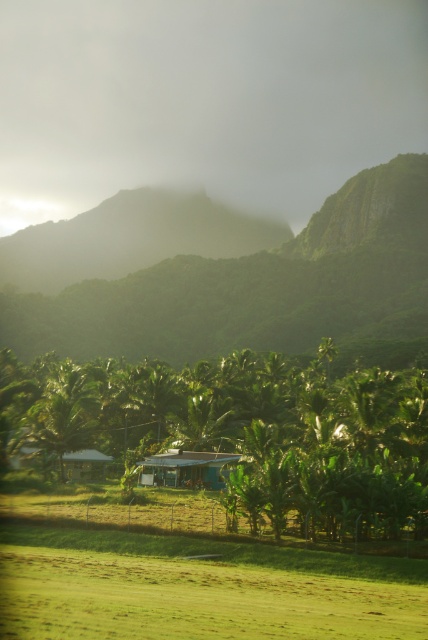
Can you confirm if green leafy tree at lower center is smaller than green corrugated metal hut at center?

No.

Between green leafy tree at lower center and green corrugated metal hut at center, which one is positioned lower?

green corrugated metal hut at center is below.

Find the location of a particular element. This screenshot has width=428, height=640. green leafy tree at lower center is located at coordinates (240, 433).

I want to click on green leafy tree at lower center, so click(x=240, y=433).

In order to click on green leafy tree at lower center in this screenshot , I will do `click(240, 433)`.

Does green leafy mountain at upper center appear on the left side of green matte hut at center?

In fact, green leafy mountain at upper center is to the right of green matte hut at center.

Can you confirm if green leafy mountain at upper center is positioned below green matte hut at center?

No, green leafy mountain at upper center is not below green matte hut at center.

This screenshot has width=428, height=640. I want to click on green leafy mountain at upper center, so click(255, 285).